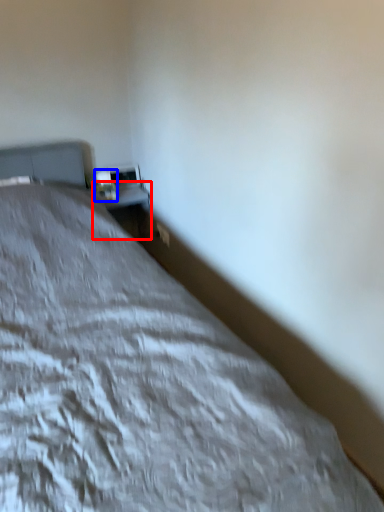
Question: Which point is further to the camera, table (highlighted by a red box) or table lamp (highlighted by a blue box)?

Choices:
 (A) table
 (B) table lamp

Answer: (A)